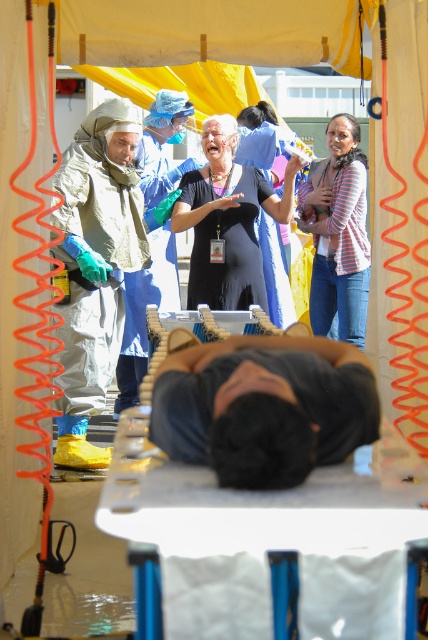
You are a photographer at the scene. You need to capture a clear photo of the striped shirt at center without the black matte dress at center blocking it. How should you adjust your position?

To capture a clear photo of the striped shirt at center without the black matte dress at center blocking it, move your position so that the striped shirt at center is no longer behind the black matte dress at center. Since the black matte dress at center is in front of the striped shirt at center, moving to the side or adjusting the angle of your camera could allow you to see around the black matte dress at center and capture the striped shirt at center directly.

You are a photographer positioned to capture the scene under the yellow canopy. You need to ensure both the matte hazmat suit at left and the black matte dress at center are visible in your photo. Based on their positions, which object is closer to the camera?

The matte hazmat suit at left is below the black matte dress at center, so the black matte dress at center is closer to the camera.

You are a medical responder assessing the scene under the yellow canopy. You notice the dark blue fabric at center and the striped shirt at center. Which object takes up more area in the image?

The striped shirt at center takes up more area than the dark blue fabric at center.